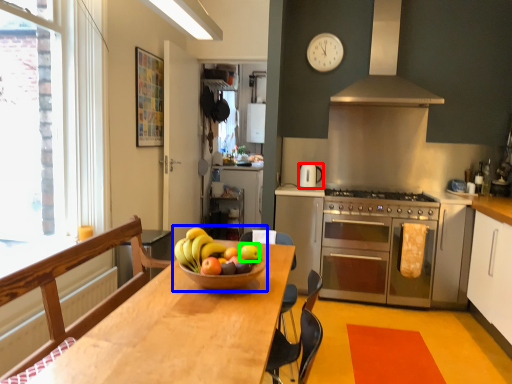
Question: Based on their relative distances, which object is farther from kitchen appliance (highlighted by a red box)? Choose from fruit dish (highlighted by a blue box) and apple (highlighted by a green box).

Choices:
 (A) fruit dish
 (B) apple

Answer: (A)